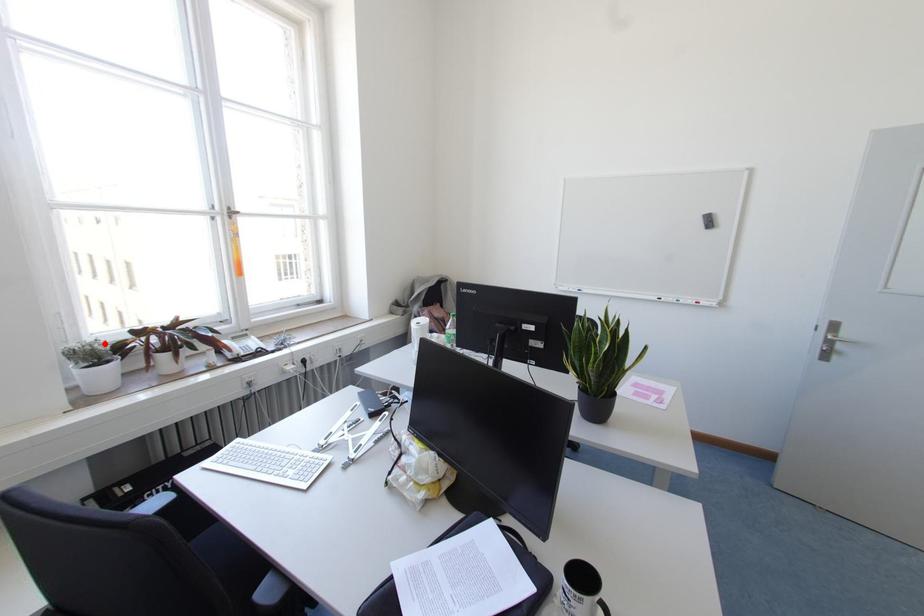
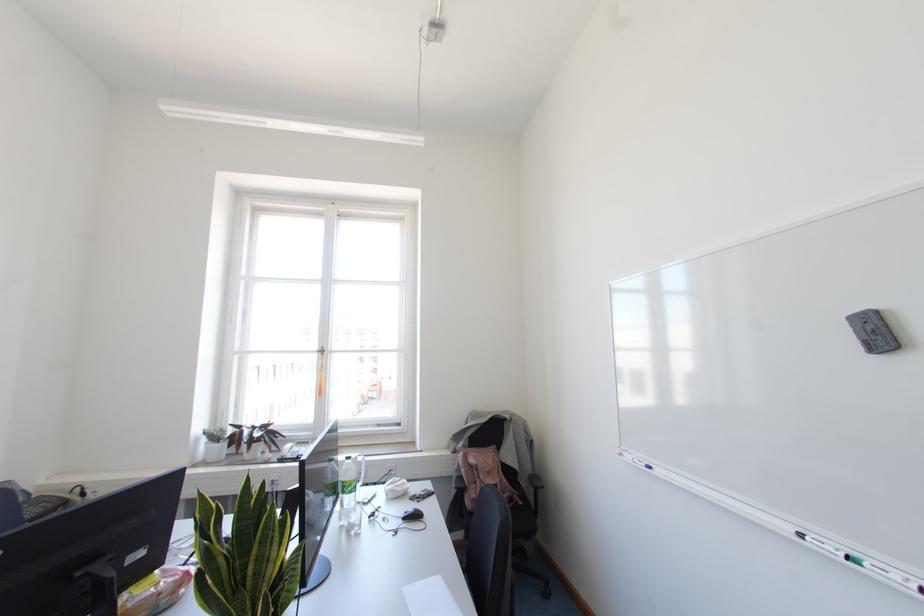
Locate, in the second image, the point that corresponds to the highlighted location in the first image.

(223, 431)